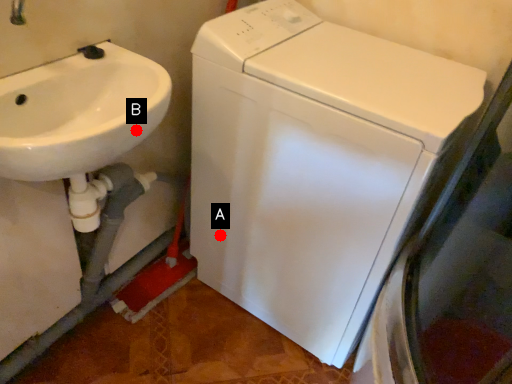
Question: Two points are circled on the image, labeled by A and B beside each circle. Which point is closer to the camera?

Choices:
 (A) A is closer
 (B) B is closer

Answer: (B)